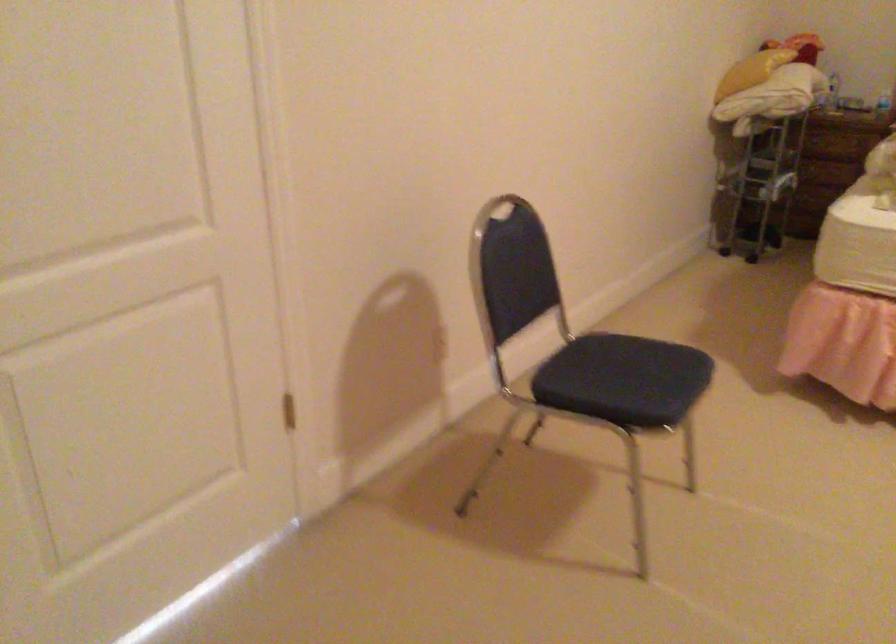
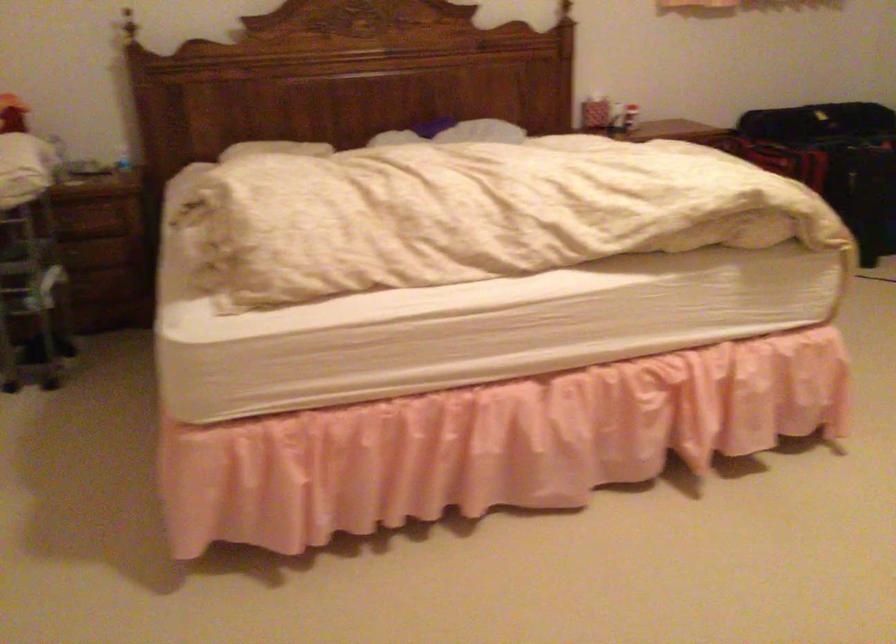
Question: The camera is either moving clockwise (left) or counter-clockwise (right) around the object. The first image is from the beginning of the video and the second image is from the end. Is the camera moving left or right when shooting the video?

Choices:
 (A) Left
 (B) Right

Answer: (A)